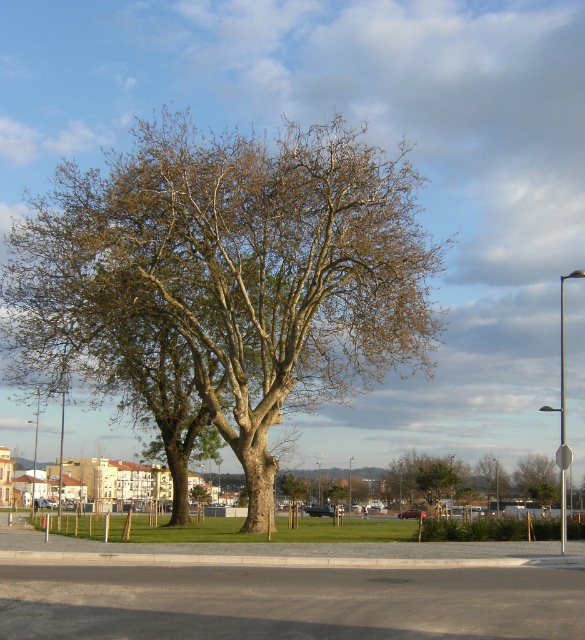
Question: Can you confirm if green rough bark tree at center is positioned below green leafy tree at lower right?

Choices:
 (A) yes
 (B) no

Answer: (B)

Question: Which of the following is the farthest from the observer?

Choices:
 (A) green rough bark tree at center
 (B) green leafy tree at lower right

Answer: (B)

Question: Does green rough bark tree at center lie in front of green leafy tree at lower right?

Choices:
 (A) no
 (B) yes

Answer: (B)

Question: Is green rough bark tree at center below green leafy tree at lower right?

Choices:
 (A) no
 (B) yes

Answer: (A)

Question: Which object appears farthest from the camera in this image?

Choices:
 (A) green rough bark tree at center
 (B) green leafy tree at lower right

Answer: (B)

Question: Which point is closer to the camera?

Choices:
 (A) (517, 490)
 (B) (439, 253)

Answer: (B)